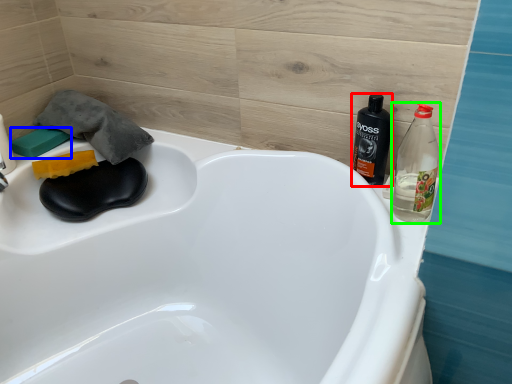
Question: Which object is positioned farthest from bottle (highlighted by a red box)? Select from soap (highlighted by a blue box) and bottle (highlighted by a green box).

Choices:
 (A) soap
 (B) bottle

Answer: (A)